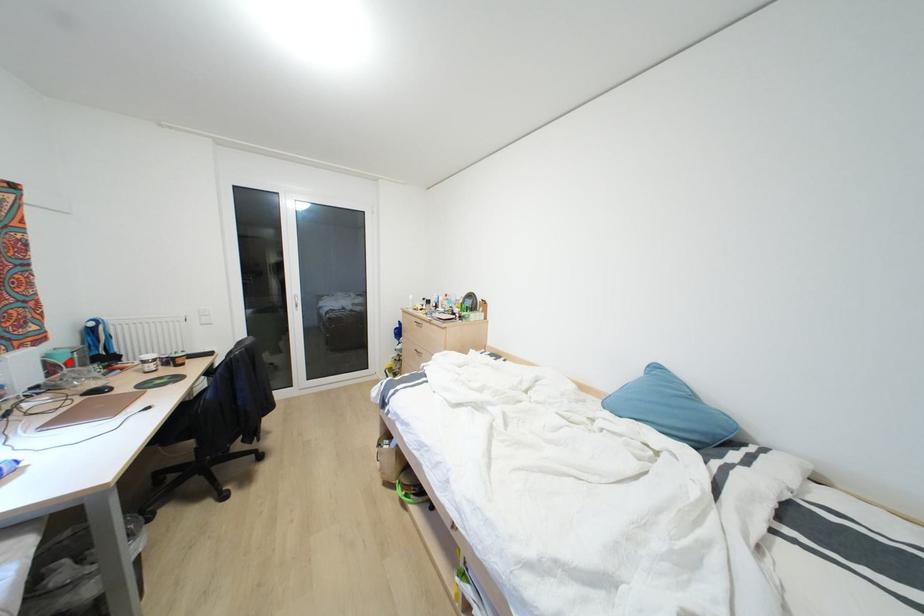
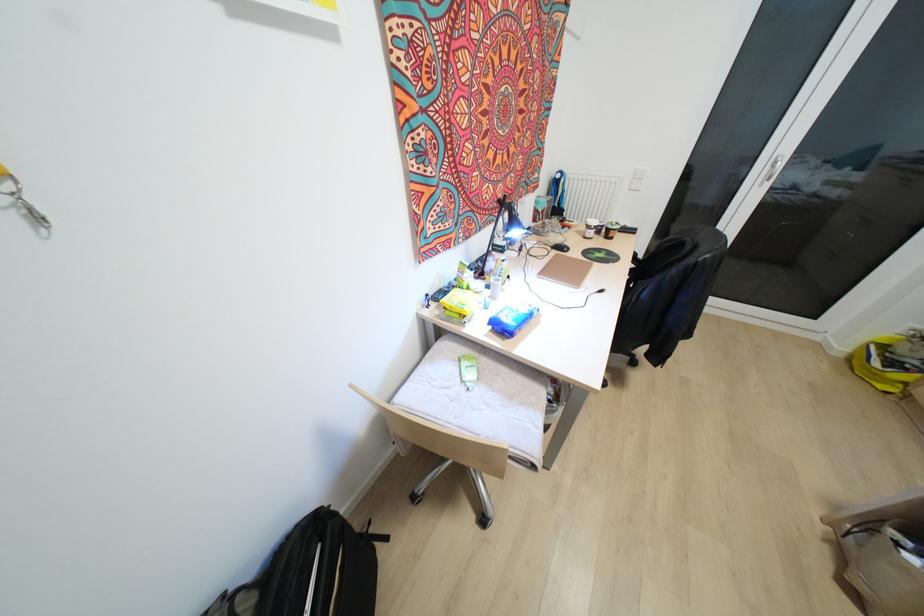
Question: A red point is marked in image1. In image2, is the corresponding 3D point closer to the camera or farther? Reply with the corresponding letter.

Choices:
 (A) The corresponding 3D point is closer.
 (B) The corresponding 3D point is farther.

Answer: (A)